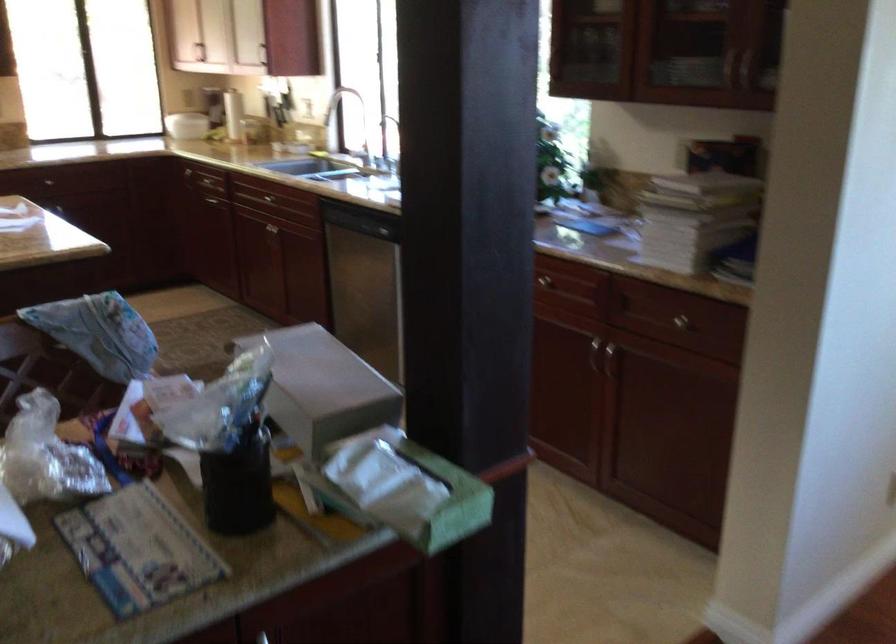
Where is `dishwasher handle`? dishwasher handle is located at coordinates (360, 223).